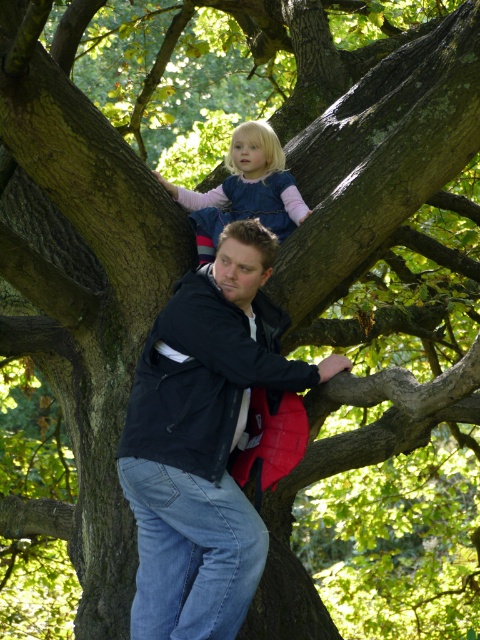
Who is positioned more to the left, black softshell jacket at center or blue denim dress at upper center?

Positioned to the left is blue denim dress at upper center.

Is point (197, 541) positioned after point (235, 220)?

No, (197, 541) is in front of (235, 220).

The image size is (480, 640). I want to click on black softshell jacket at center, so click(204, 440).

Locate an element on the screen. black softshell jacket at center is located at coordinates (204, 440).